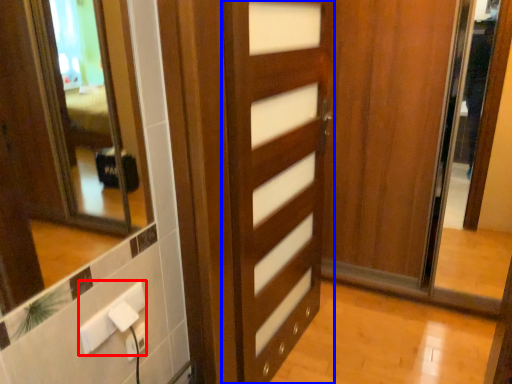
Question: Which point is further to the camera, electric outlet (highlighted by a red box) or door (highlighted by a blue box)?

Choices:
 (A) electric outlet
 (B) door

Answer: (B)